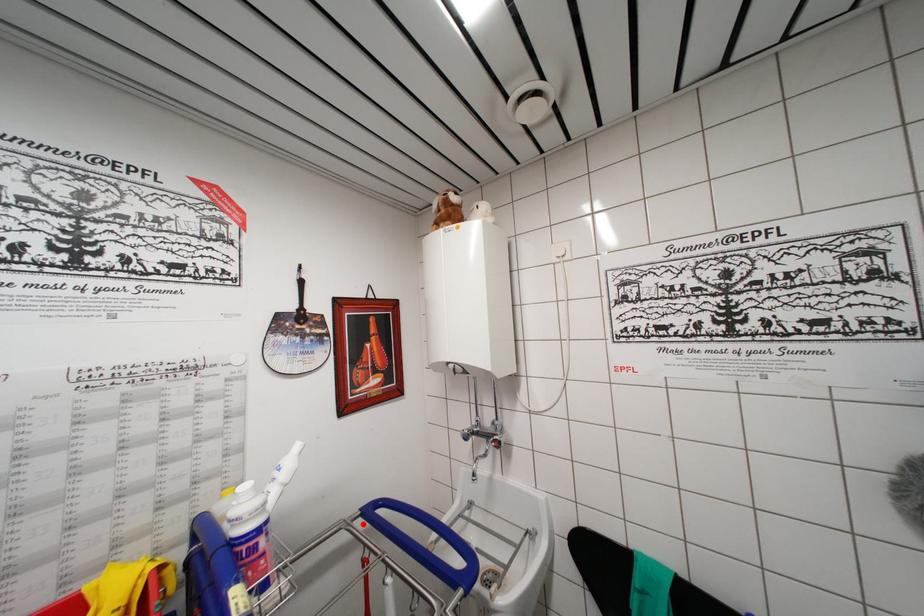
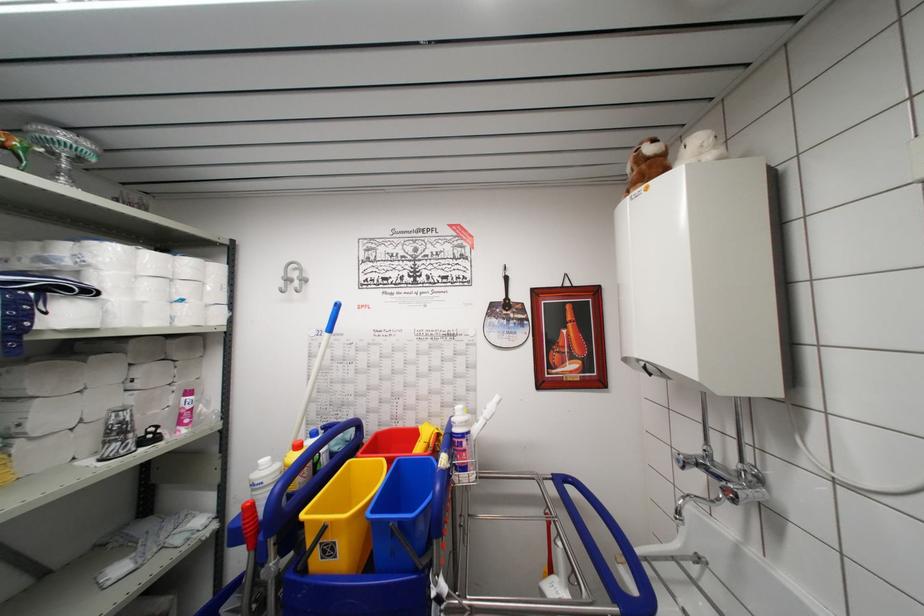
The point at the highlighted location is marked in the first image. Where is the corresponding point in the second image?

(554, 487)